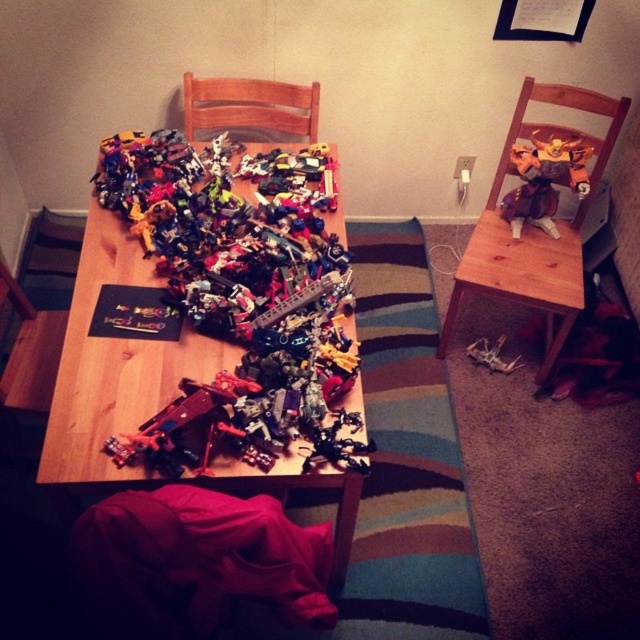
Consider the image. You are a child trying to reach the wooden table at center from your current position on the wooden chair at right. Can you easily reach the table without moving your chair?

The wooden table at center is in front of the wooden chair at right, so yes, you can easily reach the table without moving your chair since it is positioned directly in front of you.

You are a photographer holding a camera and want to take a picture of the wooden chair at right. The camera requires a minimum distance of 1.5 meters to focus properly. Can you stand where you are and take the photo?

The wooden chair at right and camera are 1.85 meters apart from each other, which is more than the required 1.5 meters. Therefore, you can stand where you are and take the photo.

You are a small toy car that is 2 inches long. You want to move from the wooden chair at right to the shiny metallic robot at upper right. Can you drive directly between them without any obstacles?

The distance between the wooden chair at right and the shiny metallic robot at upper right is 3.58 inches, which is larger than the toy car length of 2 inches. Therefore, the toy car can drive directly between them without any obstacles.